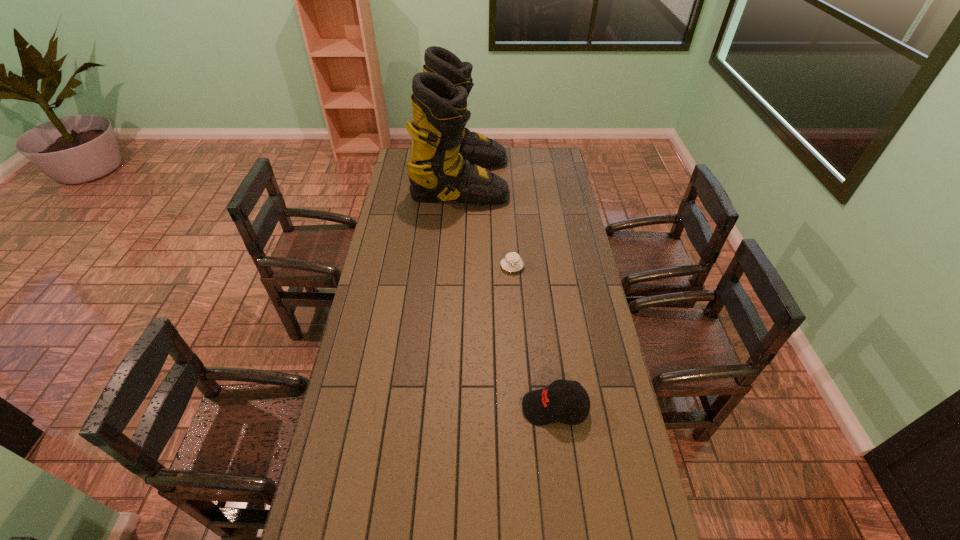
You are a GUI agent. You are given a task and a screenshot of the screen. Output one action in this format:
    pyautogui.click(x=<x>, y=<y>)
    Task: Click on the ski boots
    This screenshot has width=960, height=540.
    Given the screenshot: What is the action you would take?
    pyautogui.click(x=447, y=162)

What are the coordinates of `the farthest object` in the screenshot? It's located at (447, 162).

The image size is (960, 540). What are the coordinates of `baseball cap` in the screenshot? It's located at (540, 407).

Where is `the nearest object`? This screenshot has width=960, height=540. the nearest object is located at coordinates (540, 407).

Locate an element on the screen. This screenshot has width=960, height=540. teacup is located at coordinates (512, 262).

Where is `the shortest object`? the shortest object is located at coordinates (512, 262).

Where is `vacant space situated 0.290m on the right of the ski boots`? vacant space situated 0.290m on the right of the ski boots is located at coordinates (564, 180).

Identify the location of vacant space located on the front-facing side of the nearest object. The width and height of the screenshot is (960, 540). (506, 408).

The image size is (960, 540). What are the coordinates of `vacant space located 0.320m on the front-facing side of the nearest object` in the screenshot? It's located at (422, 408).

At what (x,y) coordinates should I click in order to perform the action: click on free space located on the front-facing side of the nearest object. Please return your answer as a coordinate pair (x, y). This screenshot has width=960, height=540. Looking at the image, I should click on (468, 408).